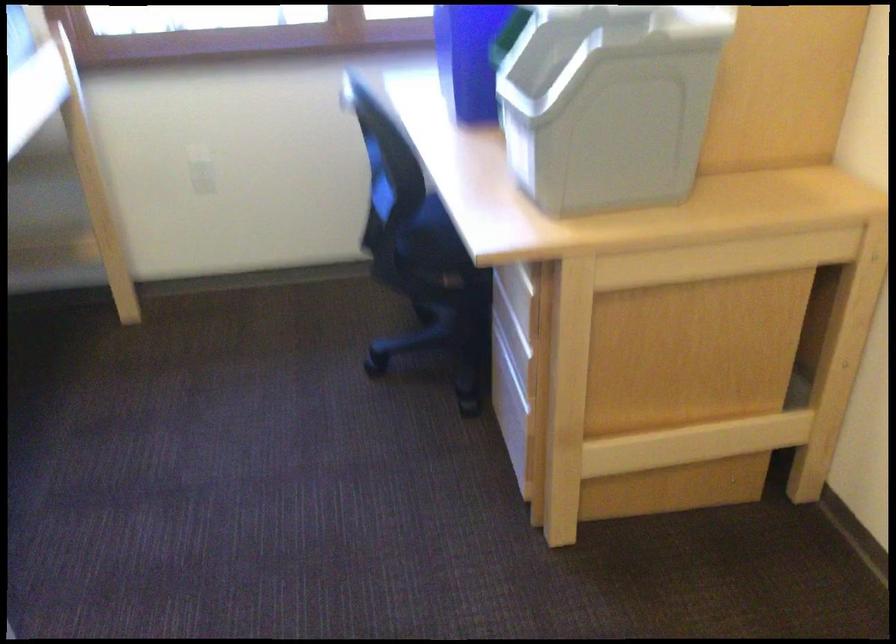
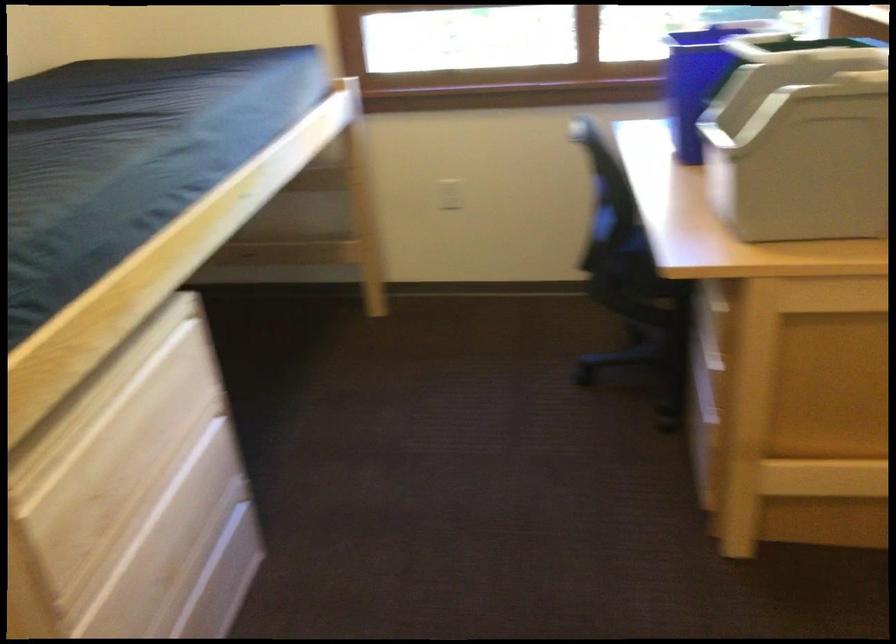
Question: The images are taken continuously from a first-person perspective. In which direction are you moving?

Choices:
 (A) Left
 (B) Right
 (C) Forward
 (D) Backward

Answer: (D)